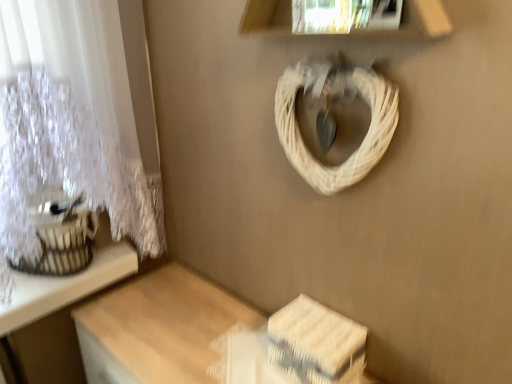
Question: Should I look upward or downward to see wooden table at lower right?

Choices:
 (A) down
 (B) up

Answer: (A)

Question: Is wooden table at lower right placed right next to white lace curtain at upper left?

Choices:
 (A) yes
 (B) no

Answer: (B)

Question: Can you confirm if wooden table at lower right is positioned to the left of white lace curtain at upper left?

Choices:
 (A) no
 (B) yes

Answer: (A)

Question: Is wooden table at lower right turned away from white lace curtain at upper left?

Choices:
 (A) yes
 (B) no

Answer: (B)

Question: Does wooden table at lower right lie in front of white lace curtain at upper left?

Choices:
 (A) no
 (B) yes

Answer: (A)

Question: From the image's perspective, is wooden table at lower right beneath white lace curtain at upper left?

Choices:
 (A) yes
 (B) no

Answer: (A)

Question: Does wooden table at lower right contain white lace curtain at upper left?

Choices:
 (A) no
 (B) yes

Answer: (A)

Question: From a real-world perspective, is white woven storage box at lower right under white wicker basket at upper center?

Choices:
 (A) no
 (B) yes

Answer: (B)

Question: Is white woven storage box at lower right bigger than white wicker basket at upper center?

Choices:
 (A) no
 (B) yes

Answer: (A)

Question: From a real-world perspective, is white woven storage box at lower right on top of white wicker basket at upper center?

Choices:
 (A) no
 (B) yes

Answer: (A)

Question: Is there a large distance between white woven storage box at lower right and white wicker basket at upper center?

Choices:
 (A) no
 (B) yes

Answer: (A)

Question: Does white woven storage box at lower right have a lesser height compared to white wicker basket at upper center?

Choices:
 (A) yes
 (B) no

Answer: (A)

Question: Are white woven storage box at lower right and white wicker basket at upper center making contact?

Choices:
 (A) yes
 (B) no

Answer: (B)

Question: Is white woven storage box at lower right bigger than white lace curtain at upper left?

Choices:
 (A) no
 (B) yes

Answer: (A)